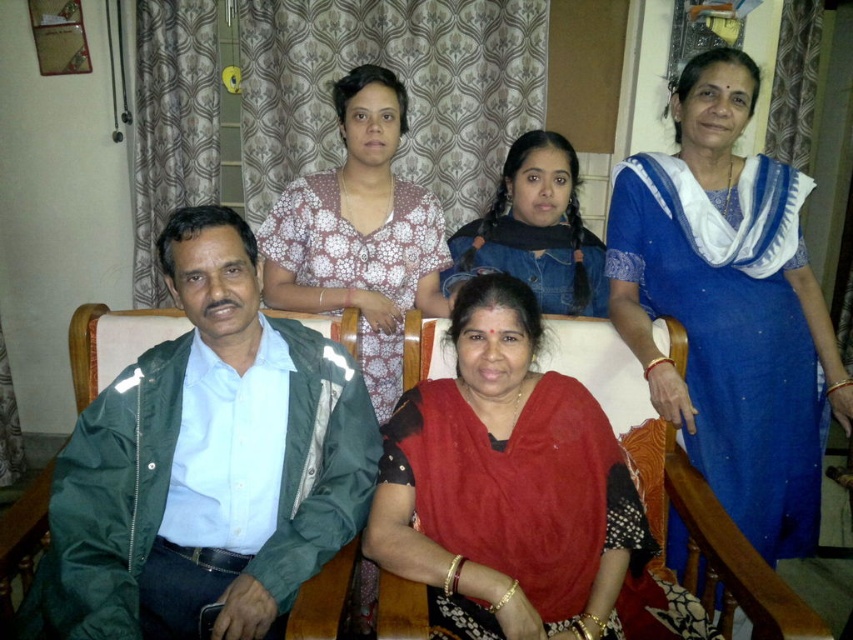
You are designing a storage rack for jackets and need to know which is wider between the green fabric jacket at left and the denim jacket at center. According to the image, which one is wider?

The green fabric jacket at left is wider than the denim jacket at center.

You are a photographer adjusting the camera focus. You need to ensure both the blue silk saree at upper right and the white dotted blouse at upper center are in focus. Which object should you focus on first to account for their sizes?

The blue silk saree at upper right has a greater height compared to the white dotted blouse at upper center, so you should focus on the blue silk saree at upper right first since it is larger and requires more attention to detail.

Based on the photo, based on the coordinates provided, which object in the scene is located at point (206, 464)?

The point (206, 464) indicates the green fabric jacket at left.